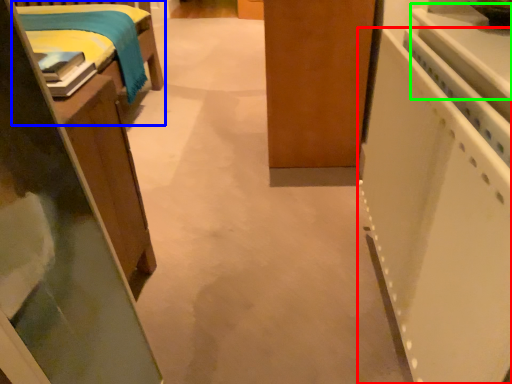
Question: Which object is the closest to the appliance (highlighted by a red box)? Choose among these: furniture (highlighted by a blue box) or counter top (highlighted by a green box).

Choices:
 (A) furniture
 (B) counter top

Answer: (B)